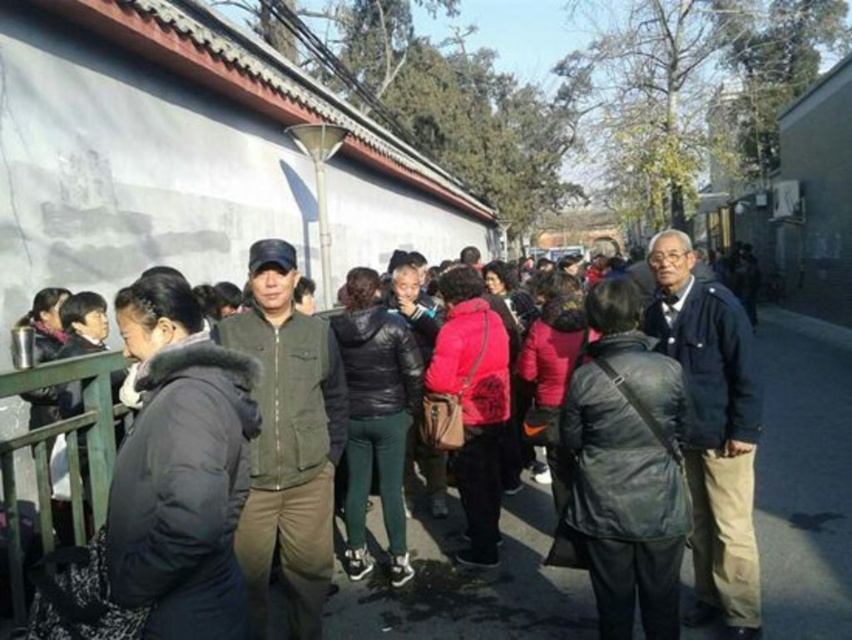
Between dark gray jacket at center and dark green jacket at center, which one is positioned higher?

dark green jacket at center

Can you confirm if dark gray jacket at center is bigger than dark green jacket at center?

Yes, dark gray jacket at center is bigger than dark green jacket at center.

What do you see at coordinates (199, 468) in the screenshot? This screenshot has height=640, width=852. I see `dark gray jacket at center` at bounding box center [199, 468].

Find the location of `dark gray jacket at center`. dark gray jacket at center is located at coordinates (199, 468).